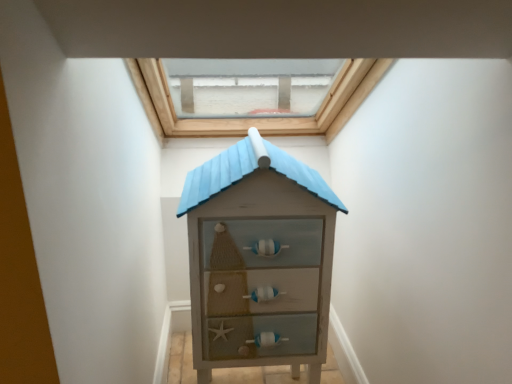
This screenshot has height=384, width=512. Describe the element at coordinates (257, 117) in the screenshot. I see `transparent glass window at upper center` at that location.

You are a GUI agent. You are given a task and a screenshot of the screen. Output one action in this format:
    pyautogui.click(x=<x>, y=<y>)
    Task: Click on the transparent glass window at upper center
    This screenshot has height=384, width=512.
    Given the screenshot: What is the action you would take?
    pyautogui.click(x=257, y=117)

Where is `wooden house-shaped chest of drawers at center`? wooden house-shaped chest of drawers at center is located at coordinates (259, 259).

What is the approximate height of wooden house-shaped chest of drawers at center?

wooden house-shaped chest of drawers at center is 1.02 meters in height.

Describe the element at coordinates (259, 259) in the screenshot. I see `wooden house-shaped chest of drawers at center` at that location.

Where is `transparent glass window at upper center`? The height and width of the screenshot is (384, 512). transparent glass window at upper center is located at coordinates (257, 117).

Can you confirm if wooden house-shaped chest of drawers at center is positioned to the left of transparent glass window at upper center?

No.

Who is more distant, wooden house-shaped chest of drawers at center or transparent glass window at upper center?

transparent glass window at upper center is more distant.

Which point is more forward, (x=262, y=156) or (x=218, y=129)?

The point (x=262, y=156) is closer to the camera.

From the image's perspective, is wooden house-shaped chest of drawers at center above or below transparent glass window at upper center?

Based on their image positions, wooden house-shaped chest of drawers at center is located beneath transparent glass window at upper center.

From a real-world perspective, which object stands above the other?

transparent glass window at upper center, from a real-world perspective.

Consider the image. In terms of width, does wooden house-shaped chest of drawers at center look wider or thinner when compared to transparent glass window at upper center?

Clearly, wooden house-shaped chest of drawers at center has less width compared to transparent glass window at upper center.

In terms of height, does wooden house-shaped chest of drawers at center look taller or shorter compared to transparent glass window at upper center?

Considering their sizes, wooden house-shaped chest of drawers at center has more height than transparent glass window at upper center.

Who is smaller, wooden house-shaped chest of drawers at center or transparent glass window at upper center?

wooden house-shaped chest of drawers at center.

Would you say wooden house-shaped chest of drawers at center is outside transparent glass window at upper center?

That's correct, wooden house-shaped chest of drawers at center is outside of transparent glass window at upper center.

Is wooden house-shaped chest of drawers at center directly adjacent to transparent glass window at upper center?

No, wooden house-shaped chest of drawers at center is not next to transparent glass window at upper center.

Consider the image. Is transparent glass window at upper center at the back of wooden house-shaped chest of drawers at center?

Yes.

Measure the distance between wooden house-shaped chest of drawers at center and transparent glass window at upper center.

A distance of 20.91 inches exists between wooden house-shaped chest of drawers at center and transparent glass window at upper center.

I want to click on window on the left of the wooden house-shaped chest of drawers at center, so click(257, 117).

Which is more to the left, transparent glass window at upper center or wooden house-shaped chest of drawers at center?

From the viewer's perspective, transparent glass window at upper center appears more on the left side.

Is transparent glass window at upper center positioned behind wooden house-shaped chest of drawers at center?

Yes, transparent glass window at upper center is behind wooden house-shaped chest of drawers at center.

Does point (227, 133) appear closer or farther from the camera than point (254, 184)?

Point (227, 133) appears to be farther away from the viewer than point (254, 184).

From the image's perspective, who appears lower, transparent glass window at upper center or wooden house-shaped chest of drawers at center?

wooden house-shaped chest of drawers at center appears lower in the image.

From a real-world perspective, relative to wooden house-shaped chest of drawers at center, is transparent glass window at upper center vertically above or below?

In terms of real-world spatial position, transparent glass window at upper center is above wooden house-shaped chest of drawers at center.

In the scene shown: Considering the relative sizes of transparent glass window at upper center and wooden house-shaped chest of drawers at center in the image provided, is transparent glass window at upper center thinner than wooden house-shaped chest of drawers at center?

No.

Does transparent glass window at upper center have a lesser height compared to wooden house-shaped chest of drawers at center?

Indeed, transparent glass window at upper center has a lesser height compared to wooden house-shaped chest of drawers at center.

Considering the relative sizes of transparent glass window at upper center and wooden house-shaped chest of drawers at center in the image provided, is transparent glass window at upper center smaller than wooden house-shaped chest of drawers at center?

No.

Is transparent glass window at upper center spatially inside wooden house-shaped chest of drawers at center, or outside of it?

transparent glass window at upper center is located beyond the bounds of wooden house-shaped chest of drawers at center.

Is transparent glass window at upper center touching wooden house-shaped chest of drawers at center?

No, transparent glass window at upper center is not touching wooden house-shaped chest of drawers at center.

Consider the image. Is transparent glass window at upper center oriented towards wooden house-shaped chest of drawers at center?

No, transparent glass window at upper center is not oriented towards wooden house-shaped chest of drawers at center.

How different are the orientations of transparent glass window at upper center and wooden house-shaped chest of drawers at center in degrees?

There is a 3.58-degree angle between the facing directions of transparent glass window at upper center and wooden house-shaped chest of drawers at center.

Where is `window positioned vertically above the wooden house-shaped chest of drawers at center (from a real-world perspective)`? This screenshot has width=512, height=384. window positioned vertically above the wooden house-shaped chest of drawers at center (from a real-world perspective) is located at coordinates (257, 117).

I want to click on the chest of drawers located in front of the transparent glass window at upper center, so click(x=259, y=259).

Where is `window above the wooden house-shaped chest of drawers at center (from the image's perspective)`? window above the wooden house-shaped chest of drawers at center (from the image's perspective) is located at coordinates (257, 117).